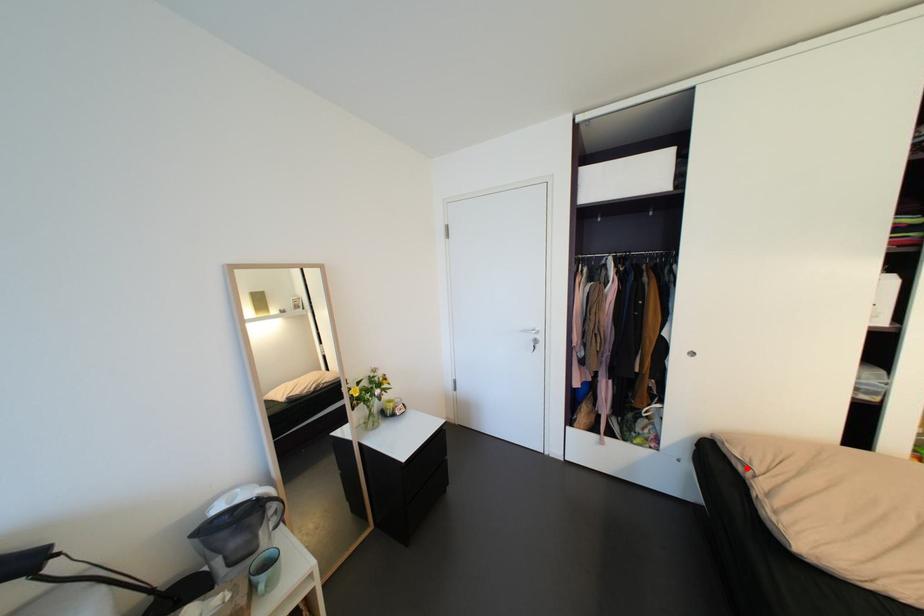
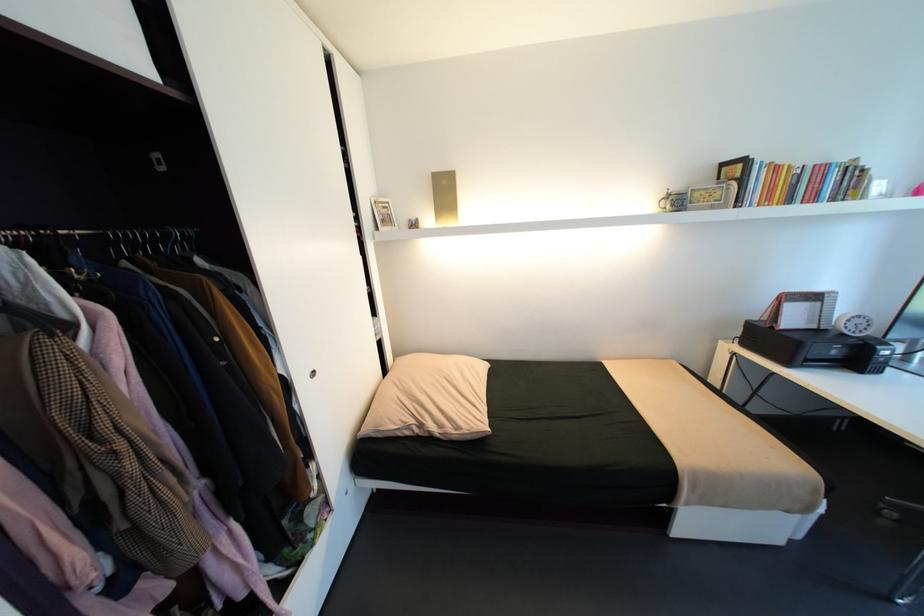
In the second image, find the point that corresponds to the highlighted location in the first image.

(415, 432)